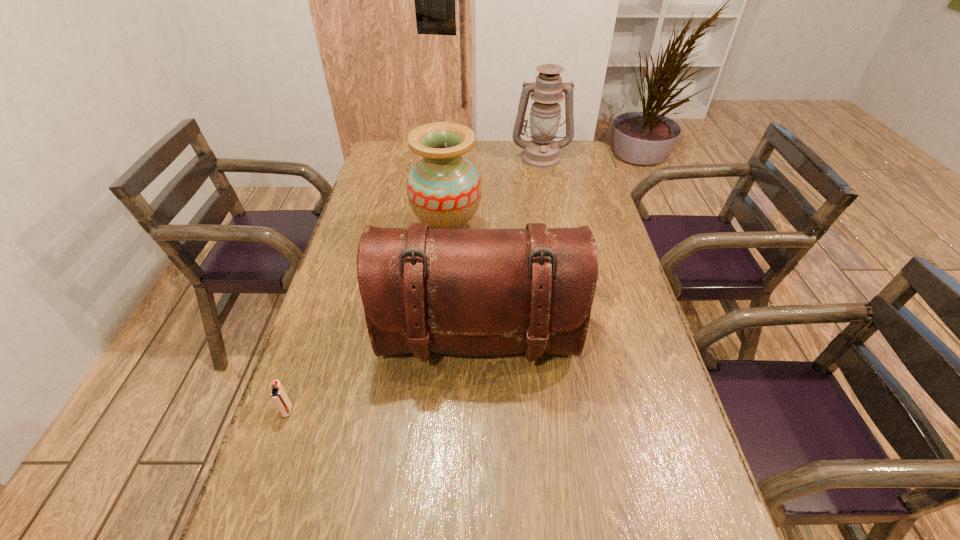
I want to click on unoccupied area between the nearest object and the second nearest object, so click(x=383, y=375).

Where is `empty location between the third nearest object and the farthest object`? The height and width of the screenshot is (540, 960). empty location between the third nearest object and the farthest object is located at coordinates (494, 196).

Identify the location of the closest object to the leftmost object. (476, 292).

Identify which object is located as the nearest to the vase. Please provide its 2D coordinates. Your answer should be formatted as a tuple, i.e. [(x, y)], where the tuple contains the x and y coordinates of a point satisfying the conditions above.

[(476, 292)]

Where is `free space in the image that satisfies the following two spatial constraints: 1. on the back side of the leftmost object; 2. on the left side of the farthest object`? The height and width of the screenshot is (540, 960). free space in the image that satisfies the following two spatial constraints: 1. on the back side of the leftmost object; 2. on the left side of the farthest object is located at coordinates coord(374,158).

Locate an element on the screen. This screenshot has width=960, height=540. vacant space that satisfies the following two spatial constraints: 1. on the back side of the leftmost object; 2. on the right side of the oil lamp is located at coordinates (374, 158).